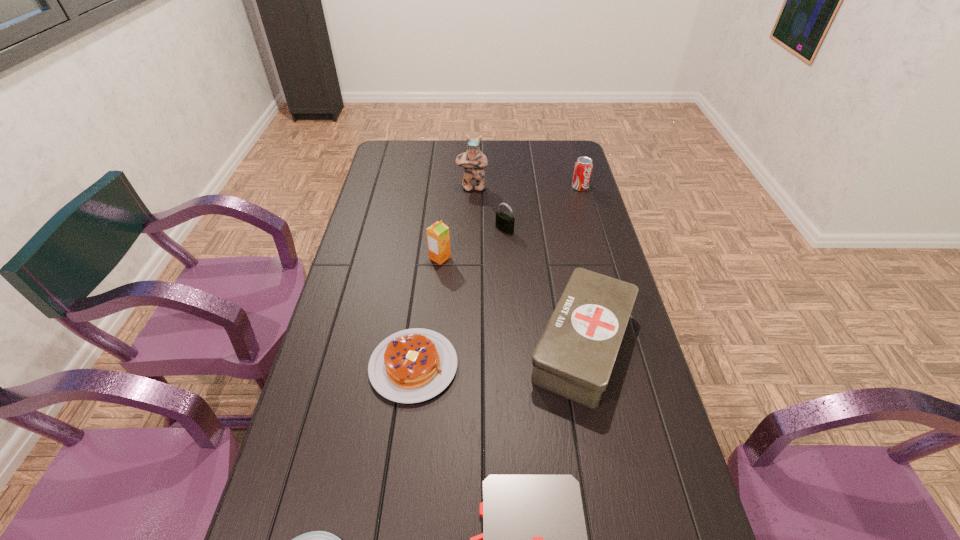
Where is `vacant region between the taller first-aid kit and the orange juice`? Image resolution: width=960 pixels, height=540 pixels. vacant region between the taller first-aid kit and the orange juice is located at coordinates (512, 302).

The height and width of the screenshot is (540, 960). I want to click on empty location between the padlock and the orange juice, so click(472, 244).

The height and width of the screenshot is (540, 960). What are the coordinates of `free space that is in between the farther pancake and the soda can` in the screenshot? It's located at (496, 276).

You are a GUI agent. You are given a task and a screenshot of the screen. Output one action in this format:
    pyautogui.click(x=<x>, y=<y>)
    Task: Click on the vacant area that lies between the fifth nearest object and the third farthest object
    The width and height of the screenshot is (960, 540).
    Given the screenshot: What is the action you would take?
    pyautogui.click(x=472, y=244)

The image size is (960, 540). I want to click on vacant space that's between the taller first-aid kit and the padlock, so click(x=543, y=287).

You are a GUI agent. You are given a task and a screenshot of the screen. Output one action in this format:
    pyautogui.click(x=<x>, y=<y>)
    Task: Click on the free space between the sixth nearest object and the tallest object
    This screenshot has width=960, height=540.
    Given the screenshot: What is the action you would take?
    pyautogui.click(x=489, y=208)

Find the location of a particular element. The height and width of the screenshot is (540, 960). object that stands as the third closest to the farther pancake is located at coordinates (438, 238).

Select which object appears as the fifth closest to the fourth farthest object. Please provide its 2D coordinates. Your answer should be formatted as a tuple, i.e. [(x, y)], where the tuple contains the x and y coordinates of a point satisfying the conditions above.

[(583, 166)]

Locate an element on the screen. Image resolution: width=960 pixels, height=540 pixels. free space in the image that satisfies the following two spatial constraints: 1. on the front-facing side of the tallest object; 2. on the left side of the sixth nearest object is located at coordinates (471, 229).

The width and height of the screenshot is (960, 540). I want to click on free space that satisfies the following two spatial constraints: 1. on the back side of the soda can; 2. on the right side of the orange juice, so click(446, 187).